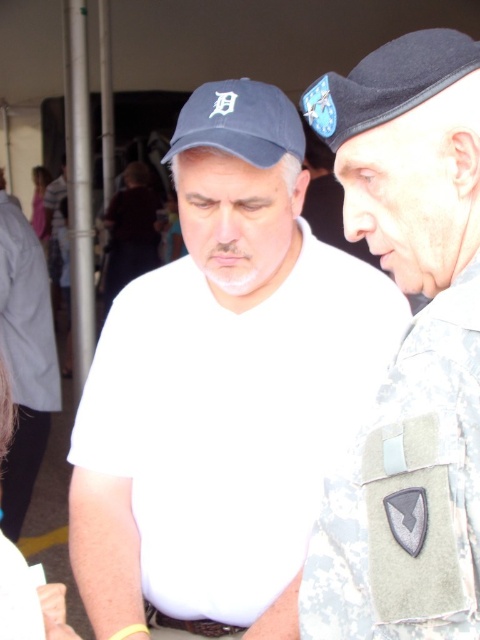
You are a photographer setting up for a group photo. You notice the camouflage fabric uniform at right and the black felt baseball cap at upper center in your frame. Which object should you adjust to ensure both are fully visible in the photo?

The camouflage fabric uniform at right is below the black felt baseball cap at upper center, so you should adjust the camouflage fabric uniform at right to ensure it does not get cut off at the bottom of the frame.

You are a photographer trying to capture a photo of the two people in the scene. The camera you are using has a rectangular viewfinder with a width of 0.6 units and a height of 0.8 units. The viewfinder is positioned such that its bottom left corner is at coordinate point 0.0, 0.0 and its top right corner is at 0.6, 0.8. The entire scene is represented within a coordinate system from 0.0 to 1.0 in both x and y axes. Can you determine if the entire camouflage fabric uniform at right will fit within the viewf

The camouflage fabric uniform at right is located at point (408, 349). Since the viewfinder extends from 0.0 to 0.6 in width and 0.0 to 0.8 in height, the x coordinate 0.547 is within the viewfinder but the y coordinate 0.850 exceeds the viewfinder height of 0.8. Therefore, the camouflage fabric uniform at right will not fit entirely within the viewfinder as part of it will be cut off at the top edge.

You are a photographer trying to capture a closeup of the black felt baseball cap at upper center and the light pink fabric at upper left. Since you can only focus on one object at a time, which object should you choose to ensure the other remains in the background?

The black felt baseball cap at upper center is closer to the viewer than the light pink fabric at upper left, so focusing on the black felt baseball cap at upper center will leave the light pink fabric at upper left in the background.